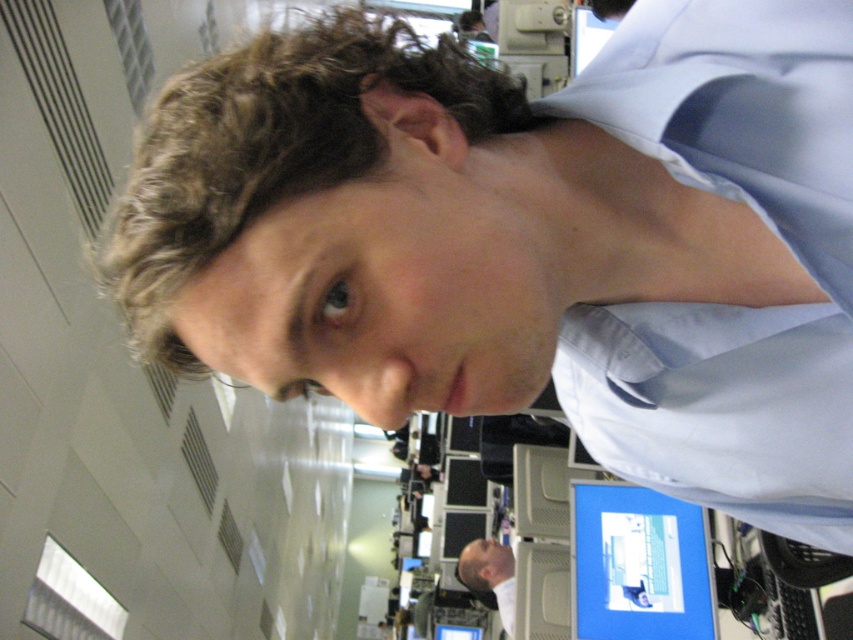
Question: Is light blue satin dress shirt at upper right further to the viewer compared to smooth bald head at lower center?

Choices:
 (A) yes
 (B) no

Answer: (B)

Question: Is light blue satin dress shirt at upper right to the left of smooth bald head at lower center from the viewer's perspective?

Choices:
 (A) no
 (B) yes

Answer: (B)

Question: Estimate the real-world distances between objects in this image. Which object is closer to the light blue satin dress shirt at upper right?

Choices:
 (A) blue glossy monitor at lower right
 (B) smooth bald head at lower center

Answer: (A)

Question: Based on their relative distances, which object is nearer to the light blue satin dress shirt at upper right?

Choices:
 (A) smooth bald head at lower center
 (B) blue glossy monitor at lower right

Answer: (B)

Question: Which object appears closest to the camera in this image?

Choices:
 (A) light blue satin dress shirt at upper right
 (B) blue glossy monitor at lower right
 (C) smooth bald head at lower center

Answer: (A)

Question: Is light blue satin dress shirt at upper right below blue glossy monitor at lower right?

Choices:
 (A) no
 (B) yes

Answer: (A)